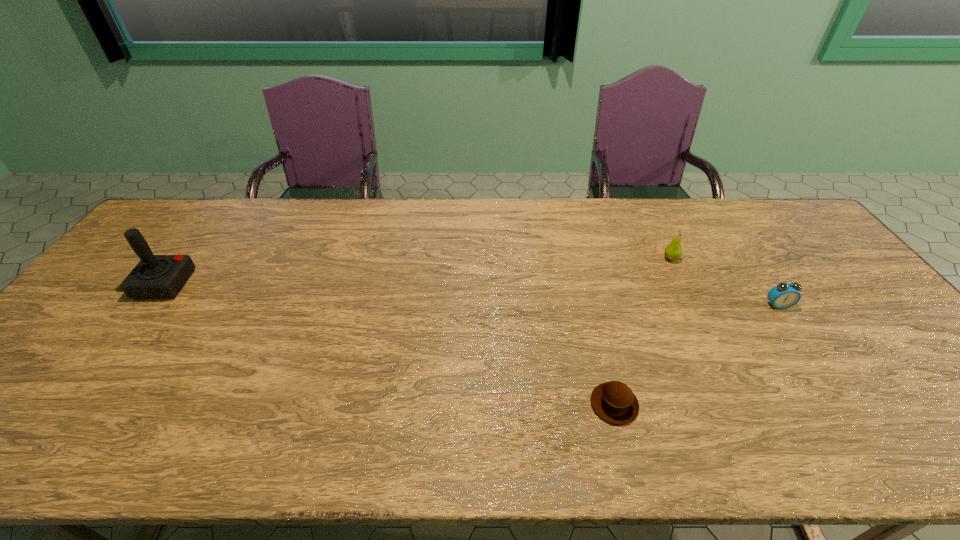
I want to click on empty space that is in between the second object from right to left and the nearest object, so click(642, 331).

Identify the location of free space that is in between the leftmost object and the farthest object. (418, 271).

Find the location of `empty space between the rightmost object and the third shortest object`. empty space between the rightmost object and the third shortest object is located at coordinates (725, 282).

Where is `vacant area that lies between the shortest object and the leftmost object`? This screenshot has height=540, width=960. vacant area that lies between the shortest object and the leftmost object is located at coordinates (390, 344).

Image resolution: width=960 pixels, height=540 pixels. In order to click on empty space between the second nearest object and the shortest object in this screenshot , I will do point(696,355).

The width and height of the screenshot is (960, 540). I want to click on vacant area that lies between the second farthest object and the farthest object, so click(418, 271).

The width and height of the screenshot is (960, 540). In order to click on empty space between the farthest object and the shortest object in this screenshot , I will do 642,331.

Identify the location of empty space that is in between the nearest object and the joystick. (390, 344).

This screenshot has width=960, height=540. What are the coordinates of `free space between the pear and the second nearest object` in the screenshot? It's located at (725, 282).

This screenshot has height=540, width=960. I want to click on vacant area between the third object from right to left and the farthest object, so click(642, 331).